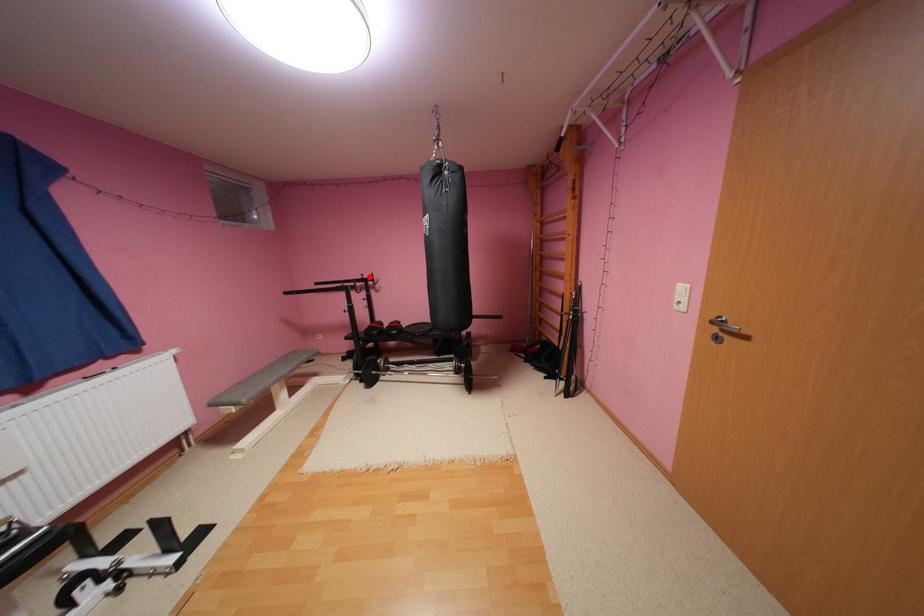
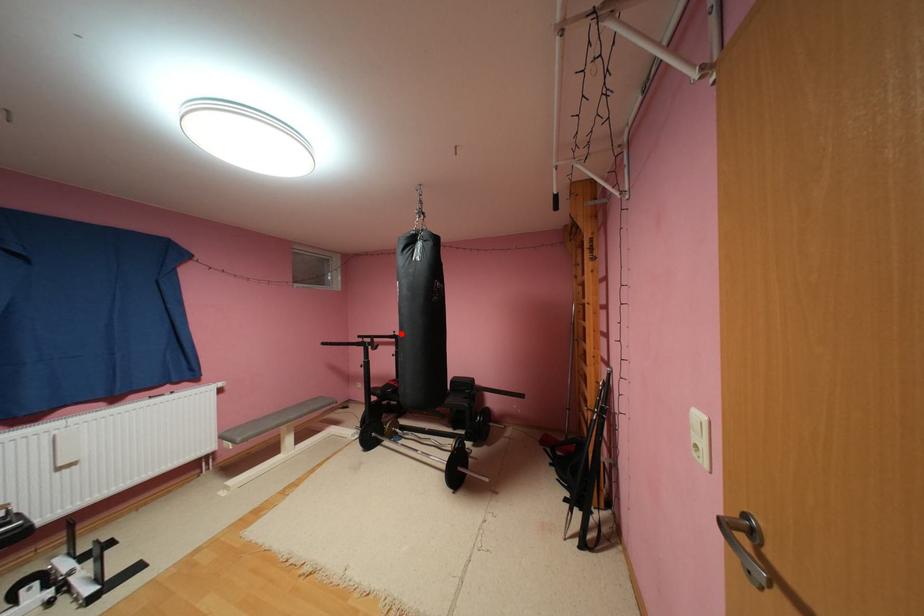
I am providing you with two images of the same scene from different viewpoints. A red point is marked on the first image and another point is marked on the second image. Does the point marked in image1 correspond to the same location as the one in image2?

Yes